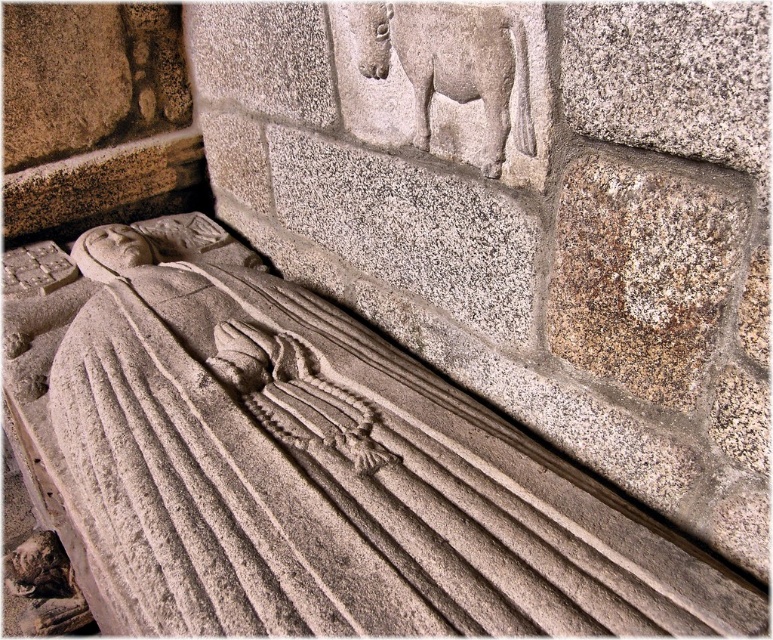
Is gray stone carving at center bigger than gray stone horse at upper center?

Indeed, gray stone carving at center has a larger size compared to gray stone horse at upper center.

Between point (278, 444) and point (410, 20), which one is positioned in front?

Point (410, 20) is more forward.

At what (x,y) coordinates should I click in order to perform the action: click on gray stone carving at center. Please return your answer as a coordinate pair (x, y). The height and width of the screenshot is (640, 773). Looking at the image, I should click on (305, 467).